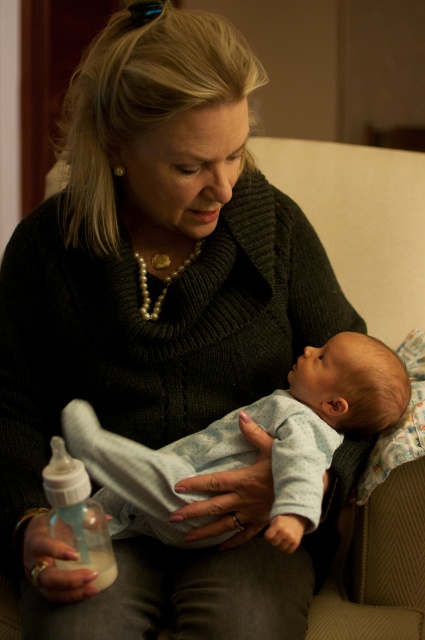
Question: Among these objects, which one is nearest to the camera?

Choices:
 (A) translucent plastic bottle at lower left
 (B) light blue soft fabric baby at center

Answer: (A)

Question: Which point is farther from the camera taking this photo?

Choices:
 (A) (56, 460)
 (B) (203, 435)

Answer: (B)

Question: Does light blue soft fabric baby at center have a lesser width compared to translucent plastic bottle at lower left?

Choices:
 (A) yes
 (B) no

Answer: (B)

Question: Does light blue soft fabric baby at center appear on the left side of translucent plastic bottle at lower left?

Choices:
 (A) yes
 (B) no

Answer: (B)

Question: Among these objects, which one is nearest to the camera?

Choices:
 (A) light blue soft fabric baby at center
 (B) translucent plastic bottle at lower left

Answer: (B)

Question: Can you confirm if light blue soft fabric baby at center is smaller than translucent plastic bottle at lower left?

Choices:
 (A) no
 (B) yes

Answer: (A)